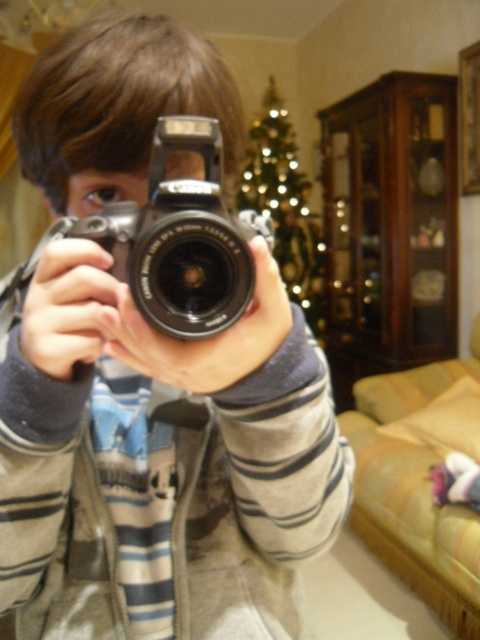
You are setting up a photo shoot and need to arrange two items in the foreground. You have a silver metallic camera at center and a shiny gold christmas tree at center. Based on their sizes, which item should you place closer to the camera to ensure it appears larger in the final photo?

The silver metallic camera at center is shorter than the shiny gold christmas tree at center, so to make it appear larger in the photo, you should place the silver metallic camera at center closer to the camera.

You are a photographer trying to choose between two cameras in the image. The matte silver camera at center and the silver metallic camera at center. Which one is bigger?

The matte silver camera at center is larger in size compared to the silver metallic camera at center.

You are setting up a photo shoot and need to position the matte silver camera at center and the shiny gold christmas tree at center in a way that the camera is visible in the reflection of the tree. Based on their current positions, is the camera likely to be visible in the tree? Explain your reasoning.

The matte silver camera at center is located below the shiny gold christmas tree at center. Since the camera is positioned below the tree, its reflection might not be visible unless the tree is angled downward or the camera is placed at an angle that allows the reflection to capture it. However, without additional adjustments, the reflection might not naturally include the camera.